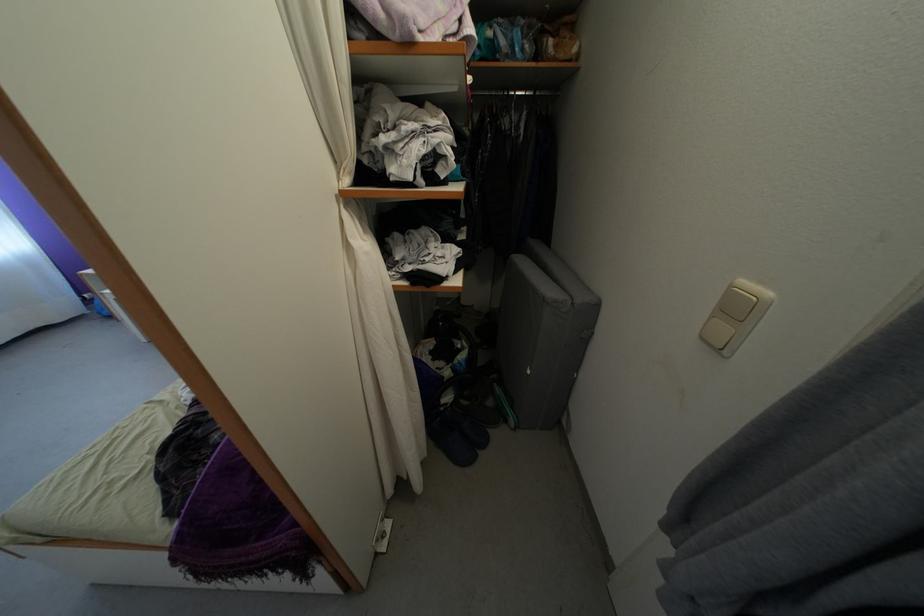
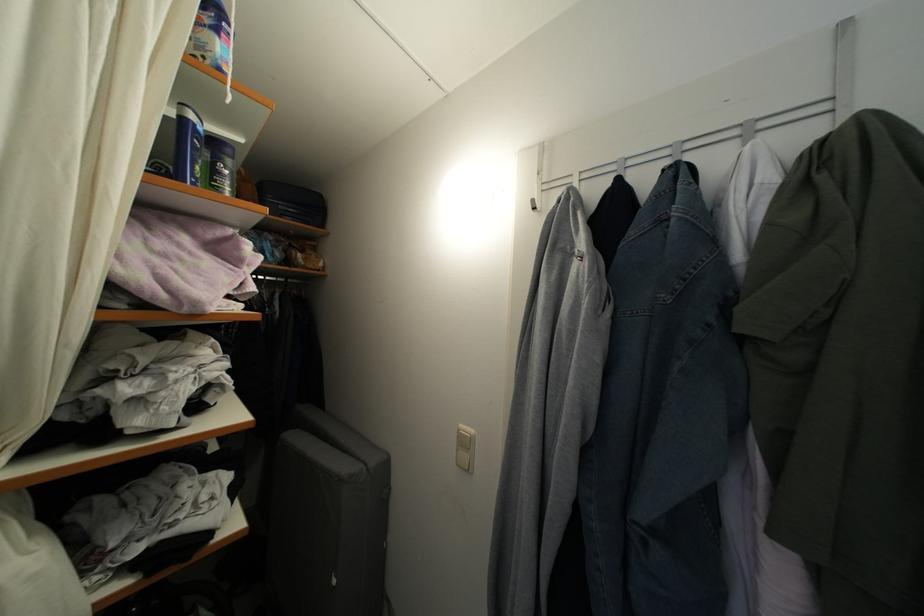
The point at (748, 286) is marked in the first image. Where is the corresponding point in the second image?

(467, 432)